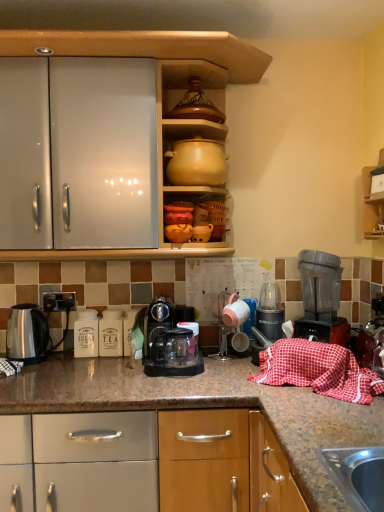
Question: Is satin silver kettle at left, marked as the first kitchen appliance in a left-to-right arrangement, in front of black plastic electric outlet at lower left?

Choices:
 (A) no
 (B) yes

Answer: (B)

Question: Are satin silver kettle at left, the third kitchen appliance viewed from the right, and black plastic electric outlet at lower left far apart?

Choices:
 (A) no
 (B) yes

Answer: (A)

Question: Is the surface of satin silver kettle at left, marked as the first kitchen appliance in a left-to-right arrangement, in direct contact with black plastic electric outlet at lower left?

Choices:
 (A) yes
 (B) no

Answer: (B)

Question: Is satin silver kettle at left, marked as the first kitchen appliance in a left-to-right arrangement, further to the viewer compared to black plastic electric outlet at lower left?

Choices:
 (A) no
 (B) yes

Answer: (A)

Question: Considering the relative positions of satin silver kettle at left, marked as the first kitchen appliance in a left-to-right arrangement, and black plastic electric outlet at lower left in the image provided, is satin silver kettle at left, marked as the first kitchen appliance in a left-to-right arrangement, to the right of black plastic electric outlet at lower left from the viewer's perspective?

Choices:
 (A) yes
 (B) no

Answer: (B)

Question: Is satin silver kettle at left, marked as the first kitchen appliance in a left-to-right arrangement, wider than black plastic electric outlet at lower left?

Choices:
 (A) yes
 (B) no

Answer: (A)

Question: Can you confirm if satin silver kettle at left, the third kitchen appliance viewed from the right, is taller than transparent plastic blender at right?

Choices:
 (A) no
 (B) yes

Answer: (A)

Question: Is satin silver kettle at left, marked as the first kitchen appliance in a left-to-right arrangement, positioned far away from transparent plastic blender at right?

Choices:
 (A) yes
 (B) no

Answer: (A)

Question: Does satin silver kettle at left, marked as the first kitchen appliance in a left-to-right arrangement, appear on the right side of transparent plastic blender at right?

Choices:
 (A) no
 (B) yes

Answer: (A)

Question: Is transparent plastic blender at right inside satin silver kettle at left, marked as the first kitchen appliance in a left-to-right arrangement?

Choices:
 (A) no
 (B) yes

Answer: (A)

Question: Is satin silver kettle at left, marked as the first kitchen appliance in a left-to-right arrangement, facing towards transparent plastic blender at right?

Choices:
 (A) yes
 (B) no

Answer: (B)

Question: Is the position of satin silver kettle at left, the third kitchen appliance viewed from the right, more distant than that of transparent plastic blender at right?

Choices:
 (A) no
 (B) yes

Answer: (B)

Question: Would you say red checkered cloth at lower right contains transparent plastic coffee maker at center, the second kitchen appliance when ordered from right to left?

Choices:
 (A) yes
 (B) no

Answer: (B)